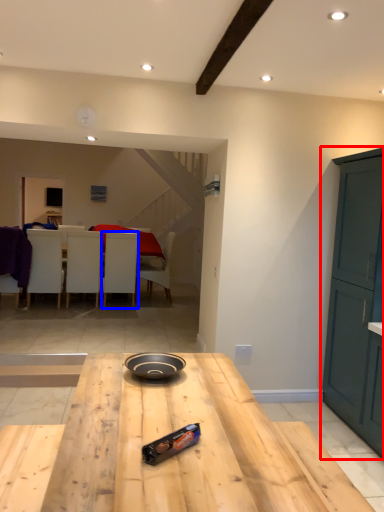
Question: Among these objects, which one is farthest to the camera, cabinetry (highlighted by a red box) or chair (highlighted by a blue box)?

Choices:
 (A) cabinetry
 (B) chair

Answer: (B)